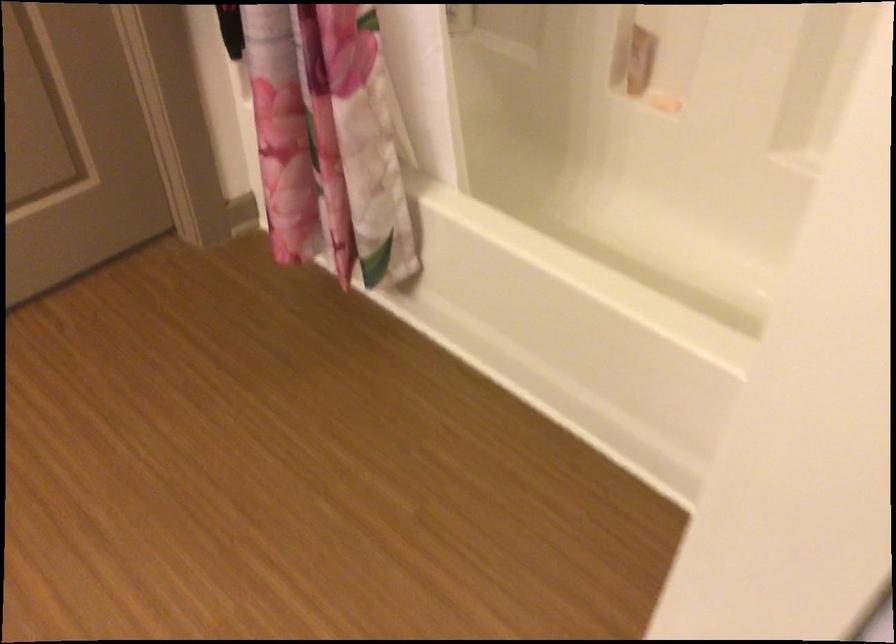
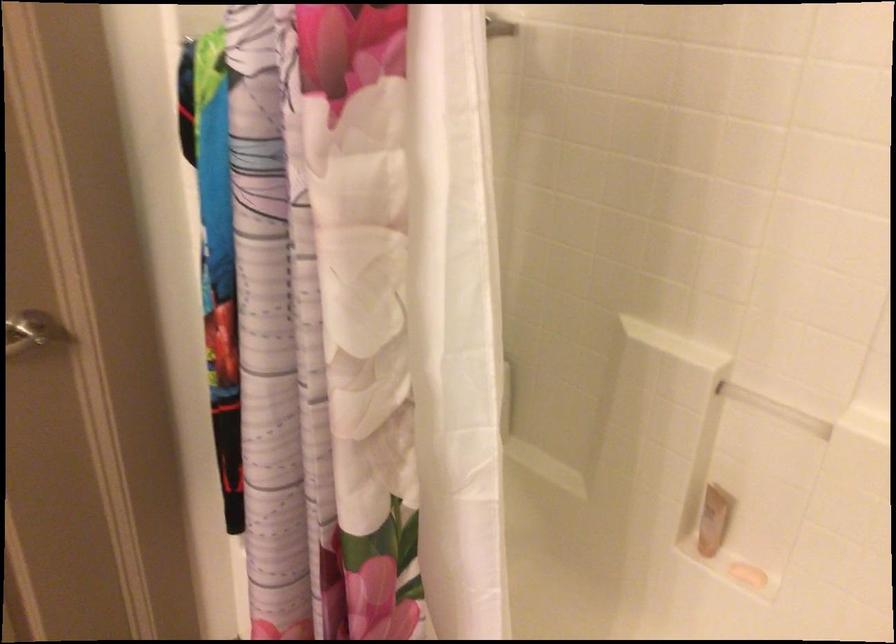
Question: The images are taken continuously from a first-person perspective. In which direction is your viewpoint rotating?

Choices:
 (A) Left
 (B) Right
 (C) Up
 (D) Down

Answer: (C)